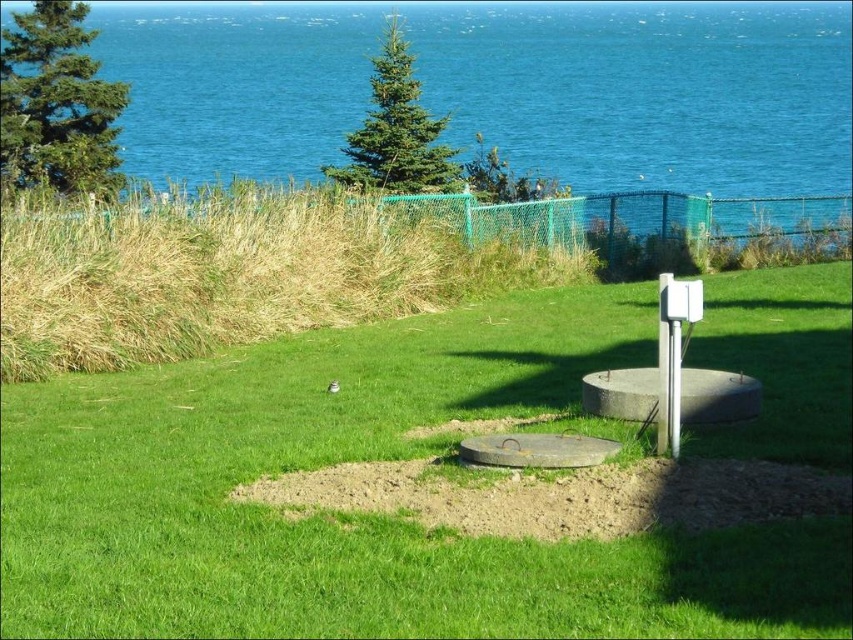
Question: Does green grassy at center have a larger size compared to blue water at upper center?

Choices:
 (A) yes
 (B) no

Answer: (B)

Question: Where is green grassy at center located in relation to blue water at upper center in the image?

Choices:
 (A) left
 (B) right

Answer: (B)

Question: Which of the following is the farthest from the observer?

Choices:
 (A) blue water at upper center
 (B) green grassy at center

Answer: (A)

Question: In this image, where is green grassy at center located relative to blue water at upper center?

Choices:
 (A) left
 (B) right

Answer: (B)

Question: Which of the following is the closest to the observer?

Choices:
 (A) tap(144, 118)
 (B) tap(146, 524)

Answer: (B)

Question: Which of the following is the closest to the observer?

Choices:
 (A) (653, 61)
 (B) (242, 396)

Answer: (B)